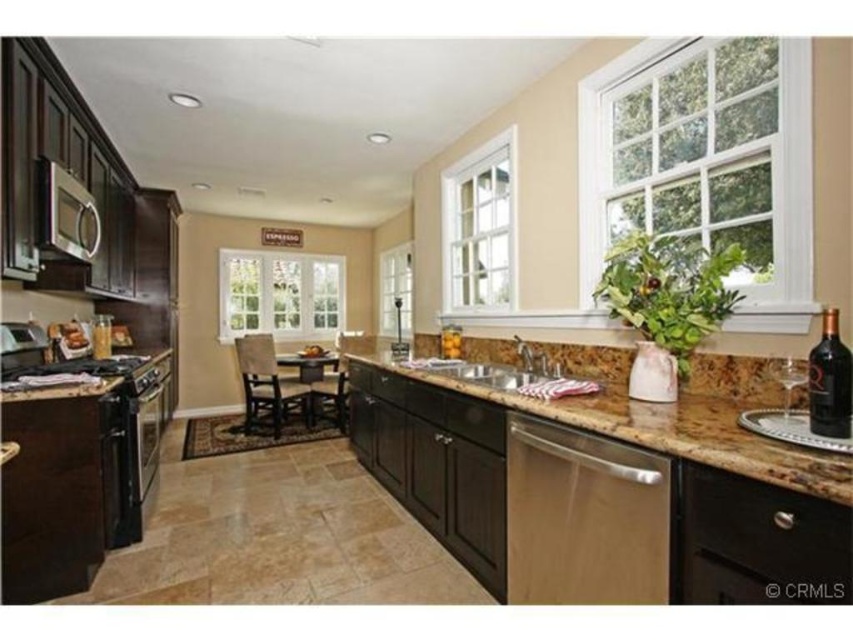
Can you confirm if white wood window at upper right is positioned to the right of dark glass bottle at right?

Incorrect, white wood window at upper right is not on the right side of dark glass bottle at right.

Who is shorter, white wood window at upper right or dark glass bottle at right?

Standing shorter between the two is dark glass bottle at right.

Measure the distance between point (x=791, y=138) and camera.

Point (x=791, y=138) is 5.72 feet from camera.

What are the coordinates of `white wood window at upper right` in the screenshot? It's located at (706, 163).

Is satin silver microwave at upper left to the right of silver metallic sink at center from the viewer's perspective?

Incorrect, satin silver microwave at upper left is not on the right side of silver metallic sink at center.

Who is shorter, satin silver microwave at upper left or silver metallic sink at center?

With less height is silver metallic sink at center.

Is point (88, 198) farther from viewer compared to point (518, 380)?

That is True.

In order to click on satin silver microwave at upper left in this screenshot , I will do `click(65, 212)`.

Who is positioned more to the left, dark glass bottle at right or stainless steel sink at center?

stainless steel sink at center is more to the left.

Between point (813, 378) and point (456, 360), which one is positioned behind?

Positioned behind is point (456, 360).

Who is more forward, (x=828, y=417) or (x=497, y=365)?

Point (x=828, y=417)

This screenshot has height=640, width=853. I want to click on dark glass bottle at right, so click(828, 380).